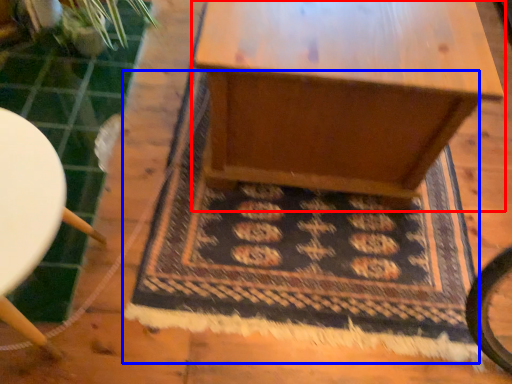
Question: Among these objects, which one is nearest to the camera, table (highlighted by a red box) or mat (highlighted by a blue box)?

Choices:
 (A) table
 (B) mat

Answer: (A)